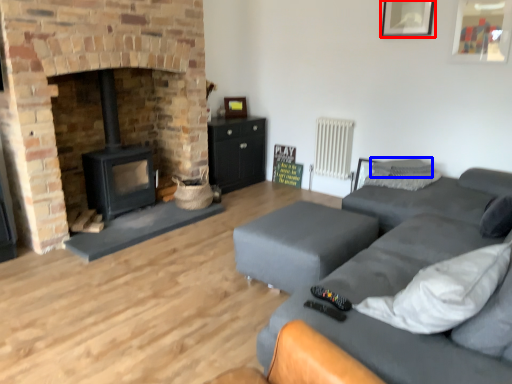
Question: Which of the following is the closest to the observer, picture frame (highlighted by a red box) or pillow (highlighted by a blue box)?

Choices:
 (A) picture frame
 (B) pillow

Answer: (A)